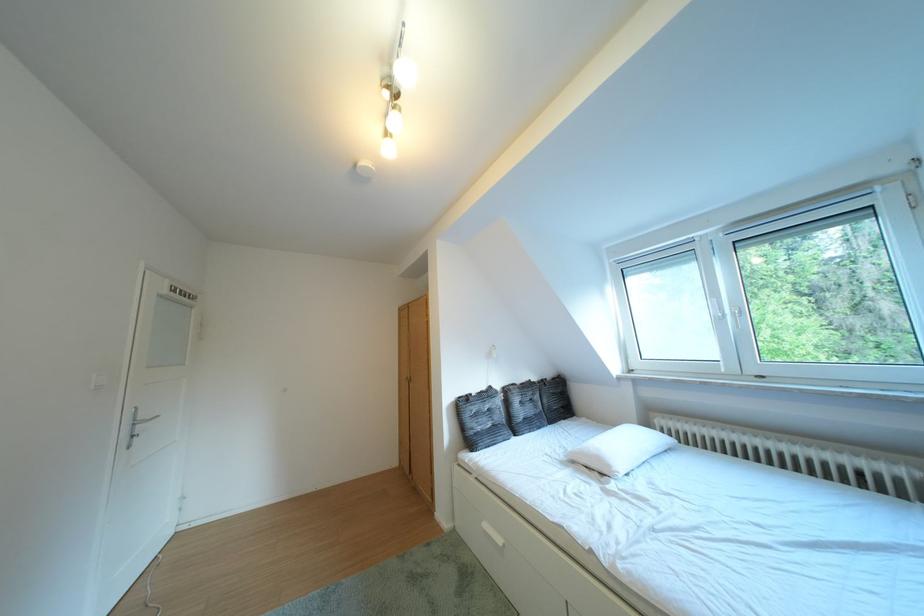
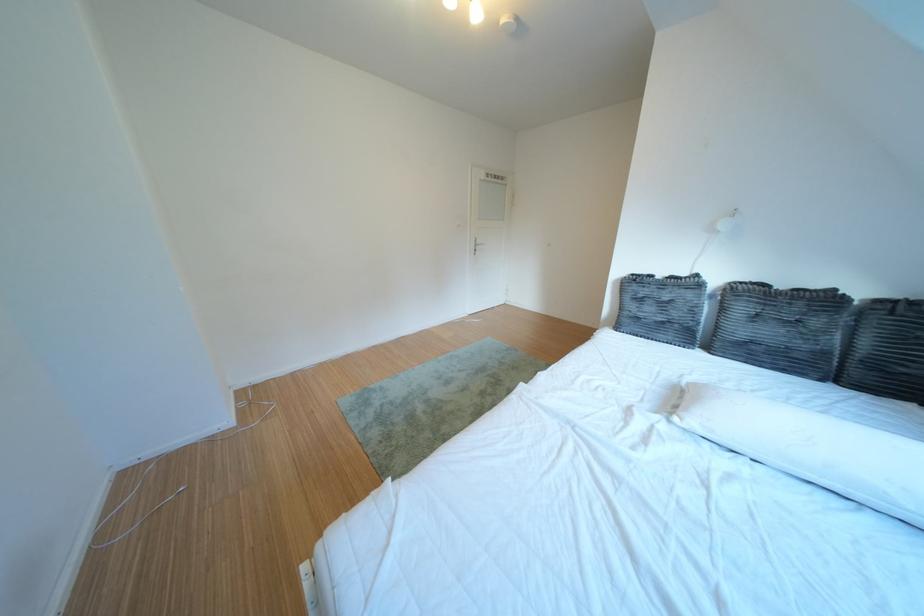
Find the pixel in the second image that matches the point at 634,474 in the first image.

(707, 424)